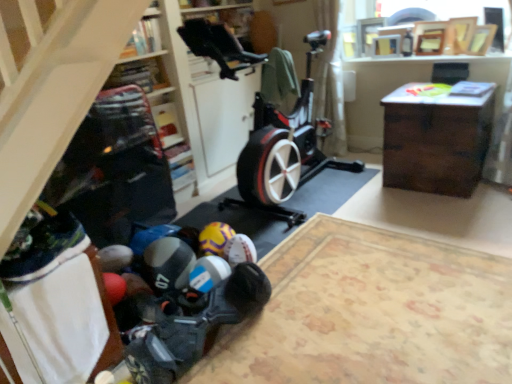
Question: Is white sheer curtain at upper center outside of wooden cabinet at center?

Choices:
 (A) yes
 (B) no

Answer: (A)

Question: Is white sheer curtain at upper center far away from wooden cabinet at center?

Choices:
 (A) yes
 (B) no

Answer: (A)

Question: Is white sheer curtain at upper center wider than wooden cabinet at center?

Choices:
 (A) no
 (B) yes

Answer: (B)

Question: From the image's perspective, is white sheer curtain at upper center on wooden cabinet at center?

Choices:
 (A) no
 (B) yes

Answer: (B)

Question: Considering the relative sizes of white sheer curtain at upper center and wooden cabinet at center in the image provided, is white sheer curtain at upper center smaller than wooden cabinet at center?

Choices:
 (A) no
 (B) yes

Answer: (B)

Question: Is white sheer curtain at upper center looking in the opposite direction of wooden cabinet at center?

Choices:
 (A) yes
 (B) no

Answer: (B)

Question: From a real-world perspective, does yellow matte soccer ball at lower center, the 1th toy when ordered from back to front, sit lower than rubberized plastic toy at lower center, marked as the second toy in a back-to-front arrangement?

Choices:
 (A) no
 (B) yes

Answer: (B)

Question: Could you tell me if yellow matte soccer ball at lower center, the 1th toy when ordered from back to front, is turned towards rubberized plastic toy at lower center, the first toy when ordered from front to back?

Choices:
 (A) yes
 (B) no

Answer: (B)

Question: From the image's perspective, is yellow matte soccer ball at lower center, the 1th toy when ordered from back to front, under rubberized plastic toy at lower center, the first toy when ordered from front to back?

Choices:
 (A) yes
 (B) no

Answer: (B)

Question: Would you say yellow matte soccer ball at lower center, the 1th toy when ordered from back to front, is outside rubberized plastic toy at lower center, the first toy when ordered from front to back?

Choices:
 (A) no
 (B) yes

Answer: (B)

Question: Does yellow matte soccer ball at lower center, which is counted as the 2th toy, starting from the front, have a lesser height compared to rubberized plastic toy at lower center, marked as the second toy in a back-to-front arrangement?

Choices:
 (A) no
 (B) yes

Answer: (B)

Question: Is yellow matte soccer ball at lower center, which is counted as the 2th toy, starting from the front, far from rubberized plastic toy at lower center, the first toy when ordered from front to back?

Choices:
 (A) yes
 (B) no

Answer: (B)

Question: Considering the relative positions of wooden cabinet at center and wooden bookshelf at upper center, acting as the second shelf starting from the bottom, in the image provided, is wooden cabinet at center behind wooden bookshelf at upper center, acting as the second shelf starting from the bottom,?

Choices:
 (A) no
 (B) yes

Answer: (A)